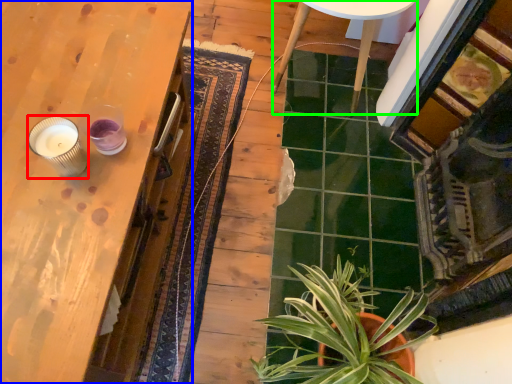
Question: Considering the real-world distances, which object is closest to candle holder (highlighted by a red box)? table (highlighted by a blue box) or round table (highlighted by a green box).

Choices:
 (A) table
 (B) round table

Answer: (A)